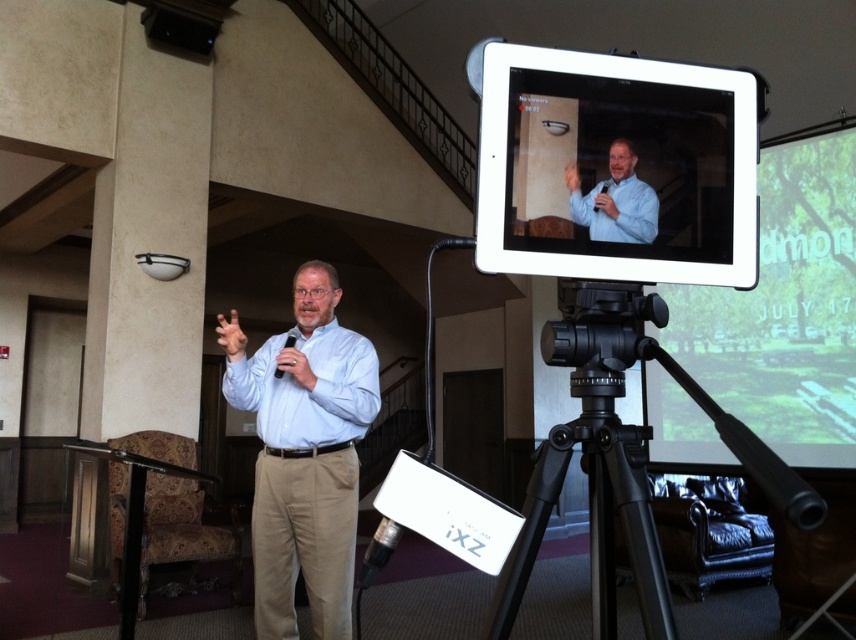
You are organizing a charity event and need to ensure that all participants have shirts of equal width. You notice the white matte dress shirt at center and the blue shirt at upper center in the image. Which shirt should you adjust to match the other in terms of width?

The white matte dress shirt at center has a larger width than the blue shirt at upper center. To make them equal, you should adjust the white matte dress shirt at center to be narrower or the blue shirt at upper center to be wider.

You are an event organizer who needs to position a new speaker stand to the left of the light blue shirt at center. Will the matte black tablet at upper right interfere with the speaker stand placement?

The matte black tablet at upper right is to the right of the light blue shirt at center, so placing the speaker stand to the left of the light blue shirt at center would not interfere with the tablet.